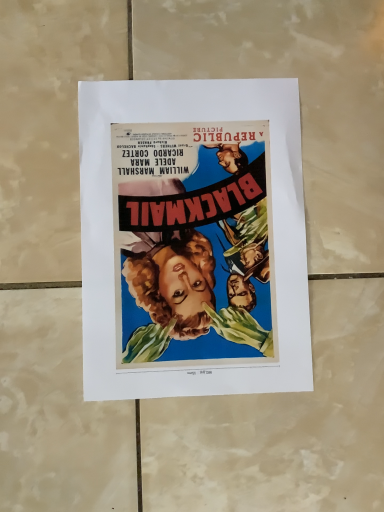
What is the approximate height of matte paper poster at center?

The height of matte paper poster at center is 0.51 inches.

In the scene shown: Measure the distance between matte paper poster at center and camera.

matte paper poster at center and camera are 15.00 inches apart from each other.

The image size is (384, 512). What do you see at coordinates (193, 239) in the screenshot?
I see `matte paper poster at center` at bounding box center [193, 239].

This screenshot has height=512, width=384. I want to click on matte paper poster at center, so click(x=193, y=239).

At what (x,y) coordinates should I click in order to perform the action: click on matte paper poster at center. Please return your answer as a coordinate pair (x, y). The width and height of the screenshot is (384, 512). Looking at the image, I should click on (193, 239).